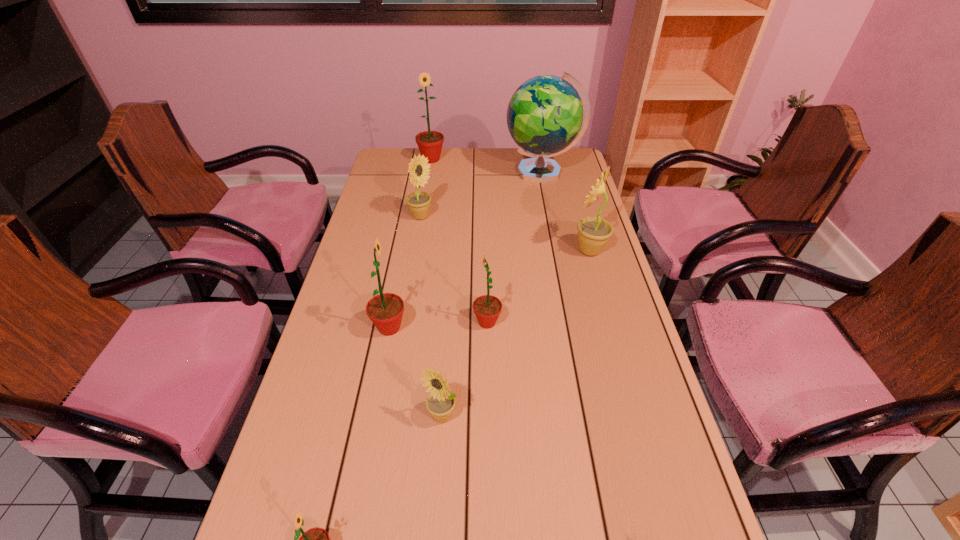
Locate an element on the screen. The width and height of the screenshot is (960, 540). vacant region located on the face of the farthest yellow sunflower is located at coordinates (448, 217).

This screenshot has height=540, width=960. Identify the location of free space located 0.300m on the face of the third biggest green sunflower. (362, 322).

This screenshot has height=540, width=960. Identify the location of free space located 0.070m on the face of the third biggest green sunflower. coord(447,322).

This screenshot has width=960, height=540. I want to click on vacant space situated on the face of the third biggest green sunflower, so 414,322.

Locate an element on the screen. Image resolution: width=960 pixels, height=540 pixels. free point located on the face of the fifth sunflower from left to right is located at coordinates (438, 462).

Locate an element on the screen. globe that is positioned at the far edge is located at coordinates (544, 116).

Where is `sunflower present at the far edge`? sunflower present at the far edge is located at coordinates [430, 143].

Where is `globe at the right edge`? The width and height of the screenshot is (960, 540). globe at the right edge is located at coordinates click(x=544, y=116).

Where is `sunflower present at the right edge`? The width and height of the screenshot is (960, 540). sunflower present at the right edge is located at coordinates (593, 232).

This screenshot has width=960, height=540. I want to click on object that is at the far left corner, so click(x=430, y=143).